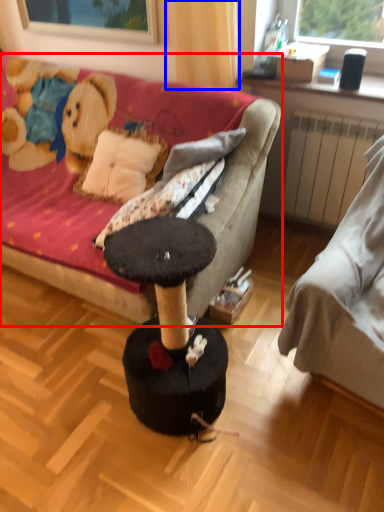
Question: Which object appears closest to the camera in this image, studio couch (highlighted by a red box) or curtain (highlighted by a blue box)?

Choices:
 (A) studio couch
 (B) curtain

Answer: (A)